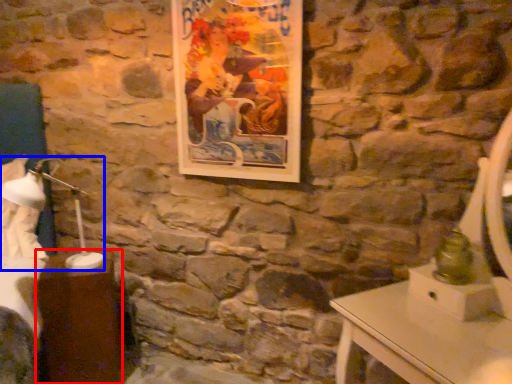
Question: Which object appears closest to the camera in this image, table (highlighted by a red box) or bedside lamp (highlighted by a blue box)?

Choices:
 (A) table
 (B) bedside lamp

Answer: (B)